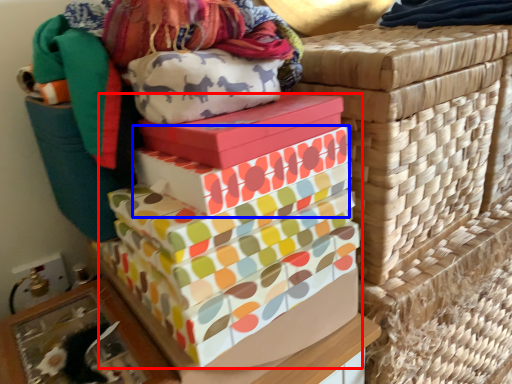
Question: Which of the following is the farthest to the observer, gift box (highlighted by a red box) or gift box (highlighted by a blue box)?

Choices:
 (A) gift box
 (B) gift box

Answer: (B)